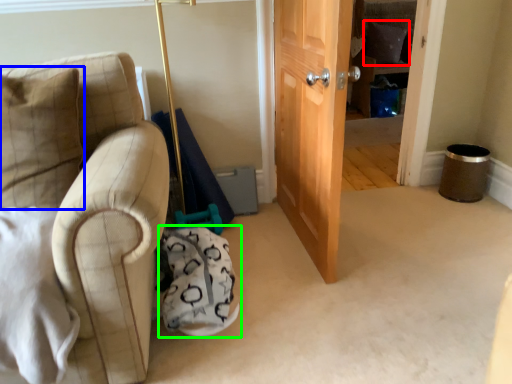
Question: Which object is the closest to the pillow (highlighted by a red box)? Choose among these: pillow (highlighted by a blue box) or swivel chair (highlighted by a green box).

Choices:
 (A) pillow
 (B) swivel chair

Answer: (B)